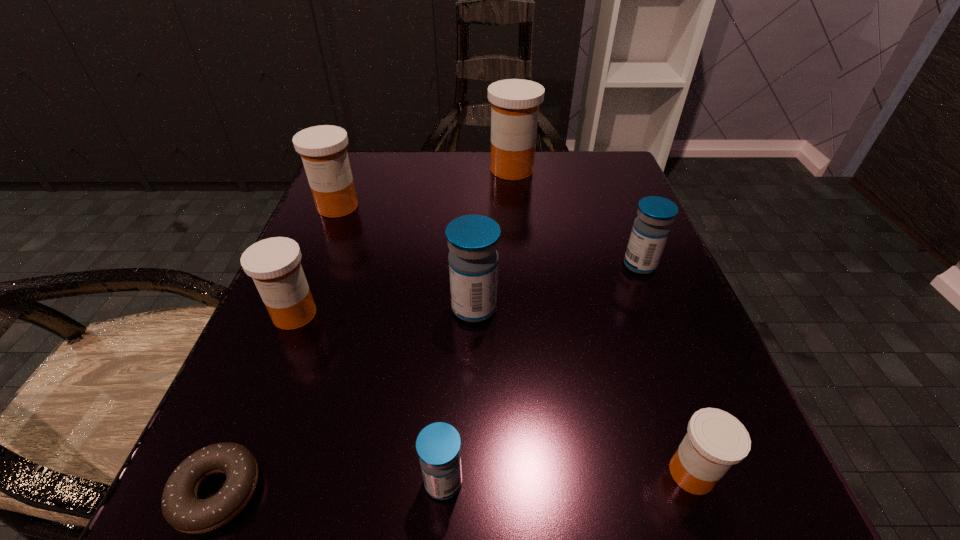
Where is `the nearest blue medicine`? The width and height of the screenshot is (960, 540). the nearest blue medicine is located at coordinates (438, 445).

At what (x,y) coordinates should I click in order to perform the action: click on brown doughnut. Please return your answer as a coordinate pair (x, y). Looking at the image, I should click on (182, 509).

Where is `the shortest object`? Image resolution: width=960 pixels, height=540 pixels. the shortest object is located at coordinates (182, 509).

This screenshot has height=540, width=960. I want to click on vacant position located 0.340m on the label of the biggest orange medicine, so click(x=336, y=170).

Identify the location of free point located 0.120m on the label of the biggest orange medicine. (434, 170).

The width and height of the screenshot is (960, 540). Identify the location of blank area located on the label of the biggest orange medicine. (412, 170).

Locate an element on the screen. The image size is (960, 540). vacant region located on the label of the sixth nearest medicine is located at coordinates (298, 302).

Image resolution: width=960 pixels, height=540 pixels. Find the location of `free spot located on the back of the second nearest blue medicine`. free spot located on the back of the second nearest blue medicine is located at coordinates [x=475, y=194].

You are a GUI agent. You are given a task and a screenshot of the screen. Output one action in this format:
    pyautogui.click(x=<x>, y=<y>)
    Task: Click on the vacant position located 0.090m on the front of the third farthest medicine
    The height and width of the screenshot is (540, 960).
    Given the screenshot: What is the action you would take?
    pyautogui.click(x=660, y=316)

The width and height of the screenshot is (960, 540). In order to click on vacant space located 0.090m on the label of the third farthest orange medicine in this screenshot , I will do `click(265, 386)`.